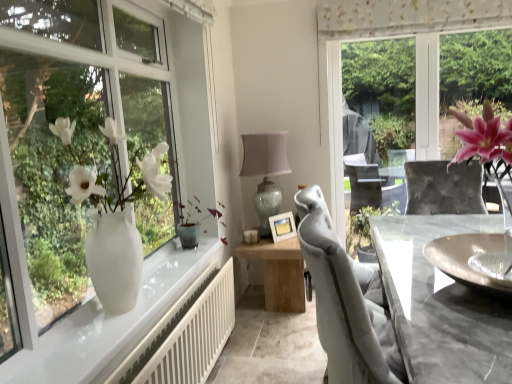
Question: Which direction should I rotate to look at sheer floral-patterned curtain at upper center?

Choices:
 (A) left
 (B) right

Answer: (B)

Question: Is green matte plant at center turned away from white glossy vase at left?

Choices:
 (A) no
 (B) yes

Answer: (A)

Question: From the image's perspective, is green matte plant at center over white glossy vase at left?

Choices:
 (A) yes
 (B) no

Answer: (B)

Question: Can you confirm if green matte plant at center is thinner than white glossy vase at left?

Choices:
 (A) no
 (B) yes

Answer: (A)

Question: Is green matte plant at center located outside white glossy vase at left?

Choices:
 (A) yes
 (B) no

Answer: (A)

Question: Would you say green matte plant at center is a long distance from white glossy vase at left?

Choices:
 (A) yes
 (B) no

Answer: (B)

Question: From the image's perspective, is green matte plant at center below white glossy vase at left?

Choices:
 (A) no
 (B) yes

Answer: (B)

Question: Is white glossy vase at left at the left side of white matte radiator at lower left?

Choices:
 (A) no
 (B) yes

Answer: (B)

Question: From a real-world perspective, is white glossy vase at left located higher than white matte radiator at lower left?

Choices:
 (A) yes
 (B) no

Answer: (A)

Question: From the image's perspective, does white glossy vase at left appear lower than white matte radiator at lower left?

Choices:
 (A) no
 (B) yes

Answer: (A)

Question: Would you say white matte radiator at lower left is part of white glossy vase at left's contents?

Choices:
 (A) yes
 (B) no

Answer: (B)

Question: Is white glossy vase at left smaller than white matte radiator at lower left?

Choices:
 (A) yes
 (B) no

Answer: (B)

Question: Are white glossy vase at left and white matte radiator at lower left beside each other?

Choices:
 (A) yes
 (B) no

Answer: (B)

Question: Does wooden table at center have a lesser height compared to matte glass table lamp at center?

Choices:
 (A) no
 (B) yes

Answer: (B)